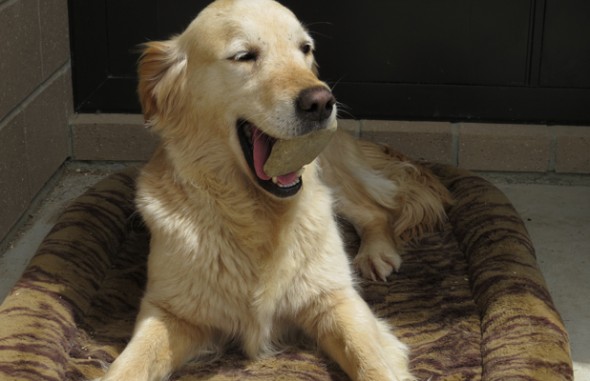
Identify the location of right front leg. This screenshot has width=590, height=381. (177, 354).